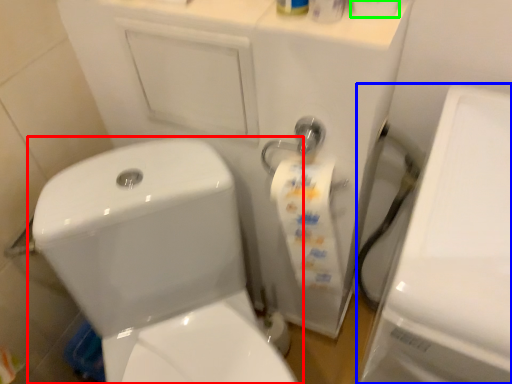
Question: Estimate the real-world distances between objects in this image. Which object is farther from toilet (highlighted by a red box), porcelain (highlighted by a blue box) or toilet paper (highlighted by a green box)?

Choices:
 (A) porcelain
 (B) toilet paper

Answer: (B)